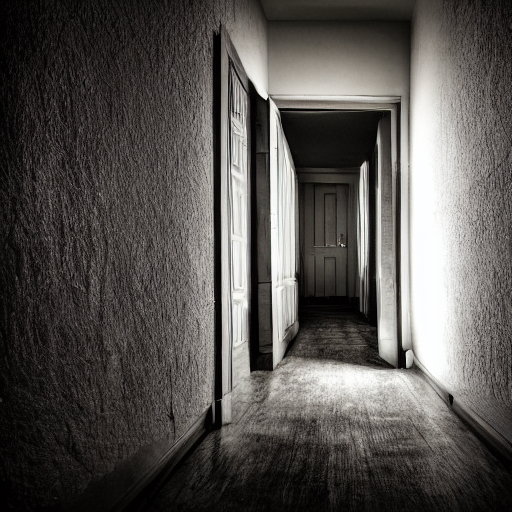
Where is `door`? The width and height of the screenshot is (512, 512). door is located at coordinates (324, 234).